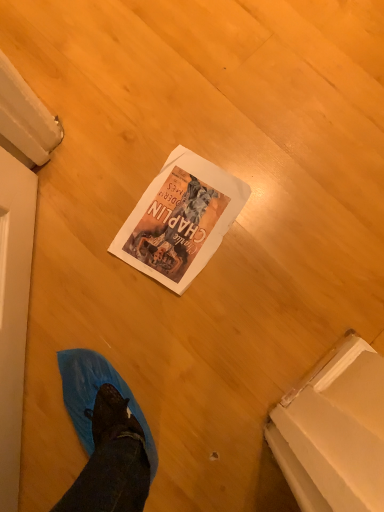
What do you see at coordinates (180, 220) in the screenshot? I see `white paper comic book at center` at bounding box center [180, 220].

Identify the location of white paper comic book at center. This screenshot has height=512, width=384. (180, 220).

Identify the location of white paper comic book at center. Image resolution: width=384 pixels, height=512 pixels. (180, 220).